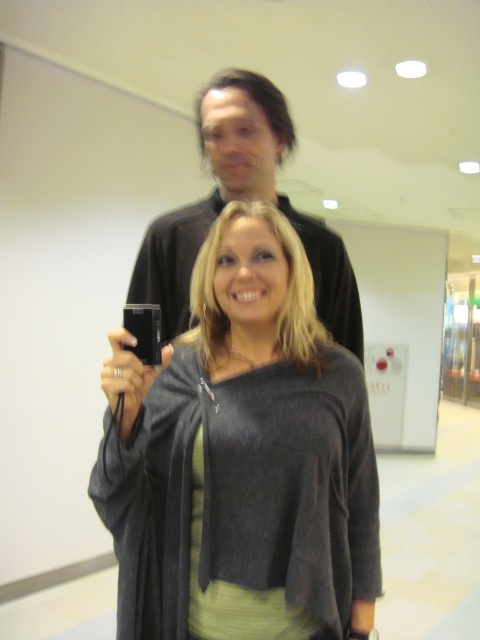
Question: Is the position of matte black camera at center more distant than that of black matte camera at upper center?

Choices:
 (A) no
 (B) yes

Answer: (A)

Question: Can you confirm if matte black camera at center is positioned to the right of black matte camera at upper center?

Choices:
 (A) no
 (B) yes

Answer: (A)

Question: Can you confirm if matte black camera at center is thinner than black matte camera at upper center?

Choices:
 (A) yes
 (B) no

Answer: (A)

Question: Which object appears closest to the camera in this image?

Choices:
 (A) matte black camera at center
 (B) black matte camera at upper center

Answer: (A)